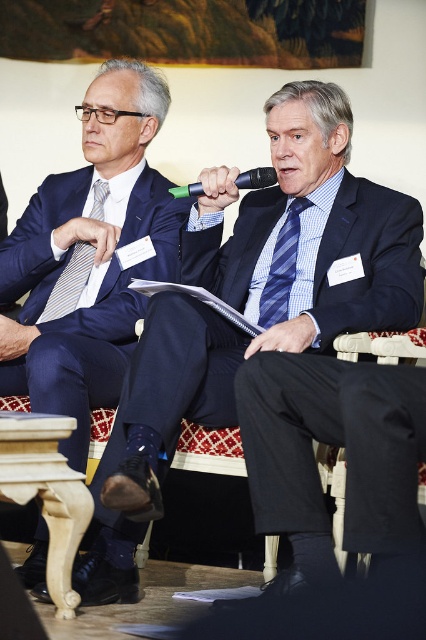
Is blue striped tie at center smaller than green plastic microphone at center?

Yes, blue striped tie at center is smaller than green plastic microphone at center.

Who is more forward, (282, 288) or (181, 186)?

Positioned in front is point (282, 288).

Between point (290, 266) and point (196, 188), which one is positioned behind?

Positioned behind is point (290, 266).

Where is `blue striped tie at center`? blue striped tie at center is located at coordinates (282, 268).

Is matte black suit at left positioned in front of blue striped tie at center?

Yes.

Between matte black suit at left and blue striped tie at center, which one appears on the left side from the viewer's perspective?

Positioned to the left is matte black suit at left.

Where is `matte black suit at left`? matte black suit at left is located at coordinates (89, 257).

Does matte black suit at left have a lesser height compared to striped fabric tie at left?

No.

Which is more to the left, matte black suit at left or striped fabric tie at left?

striped fabric tie at left

Locate an element on the screen. The image size is (426, 640). matte black suit at left is located at coordinates coord(89,257).